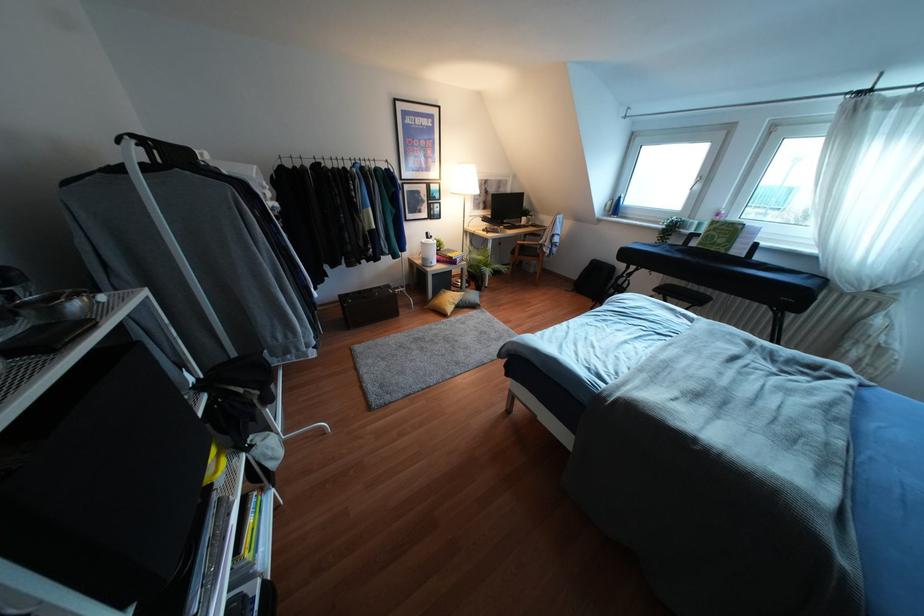
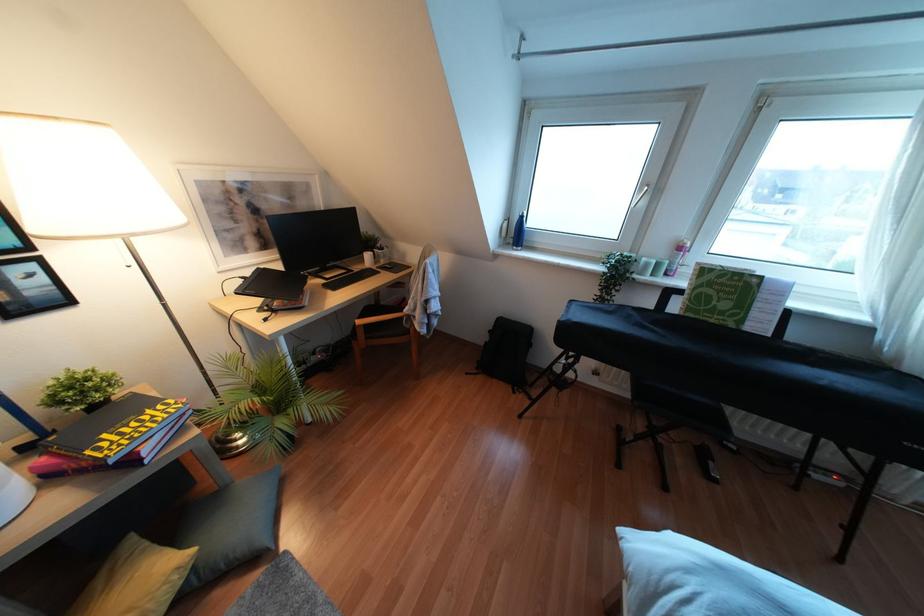
Which direction would the cameraman need to move to produce the second image?

The cameraman walked toward right, forward.